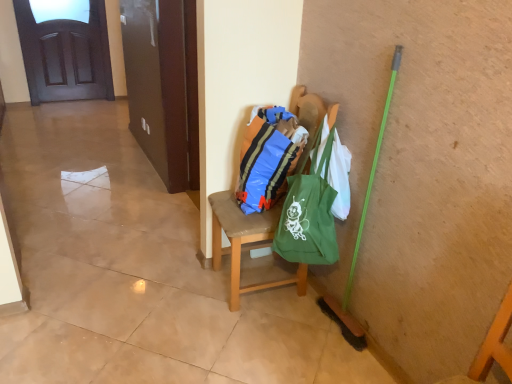
Question: Based on their sizes in the image, would you say blue plastic bag at center is bigger or smaller than green fabric bag at center?

Choices:
 (A) small
 (B) big

Answer: (A)

Question: From a real-world perspective, is blue plastic bag at center positioned above or below green fabric bag at center?

Choices:
 (A) above
 (B) below

Answer: (A)

Question: Based on their relative distances, which object is nearer to the dark wood door at upper left?

Choices:
 (A) green fabric bag at center
 (B) green canvas tote at center
 (C) green fabric bag at center
 (D) blue plastic bag at center

Answer: (A)

Question: Based on their relative distances, which object is farther from the dark wood door at upper left?

Choices:
 (A) green fabric bag at center
 (B) green fabric bag at center
 (C) green canvas tote at center
 (D) blue plastic bag at center

Answer: (B)